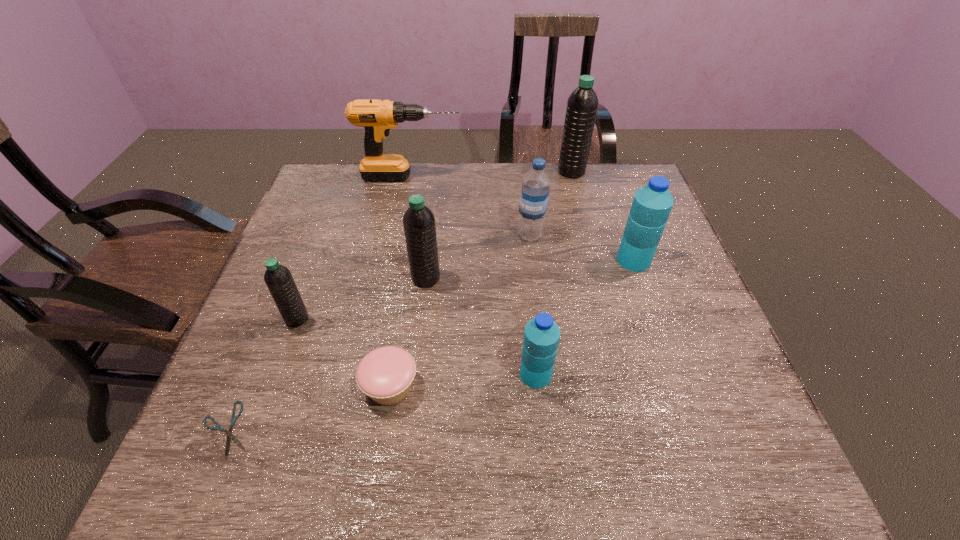
In the image, there is a desktop. Where is `vacant region at the far left corner`? Image resolution: width=960 pixels, height=540 pixels. vacant region at the far left corner is located at coordinates (316, 199).

Image resolution: width=960 pixels, height=540 pixels. I want to click on vacant space at the far right corner of the desktop, so click(x=636, y=180).

Where is `unoccupied area between the fourth nearest object and the rightmost water bottle`? The image size is (960, 540). unoccupied area between the fourth nearest object and the rightmost water bottle is located at coordinates (466, 289).

Where is `vacant space that is in between the rightmost blue water bottle and the black shears`? The height and width of the screenshot is (540, 960). vacant space that is in between the rightmost blue water bottle and the black shears is located at coordinates (430, 345).

Locate an element on the screen. The height and width of the screenshot is (540, 960). vacant point located between the nearest water bottle and the third farthest object is located at coordinates (x=533, y=305).

Find the location of a particular element. The width and height of the screenshot is (960, 540). free spot between the shears and the tallest object is located at coordinates (398, 300).

Locate an element on the screen. vacant point located between the smallest blue water bottle and the rightmost water bottle is located at coordinates (585, 318).

In order to click on free area in between the second black water bottle from left to right and the leftmost black water bottle in this screenshot , I will do `click(362, 299)`.

Where is `vacant area that lies between the leftmost black water bottle and the nearest blue water bottle`? vacant area that lies between the leftmost black water bottle and the nearest blue water bottle is located at coordinates (417, 347).

Identify the location of the closest object to the second black water bottle from left to right. (385, 374).